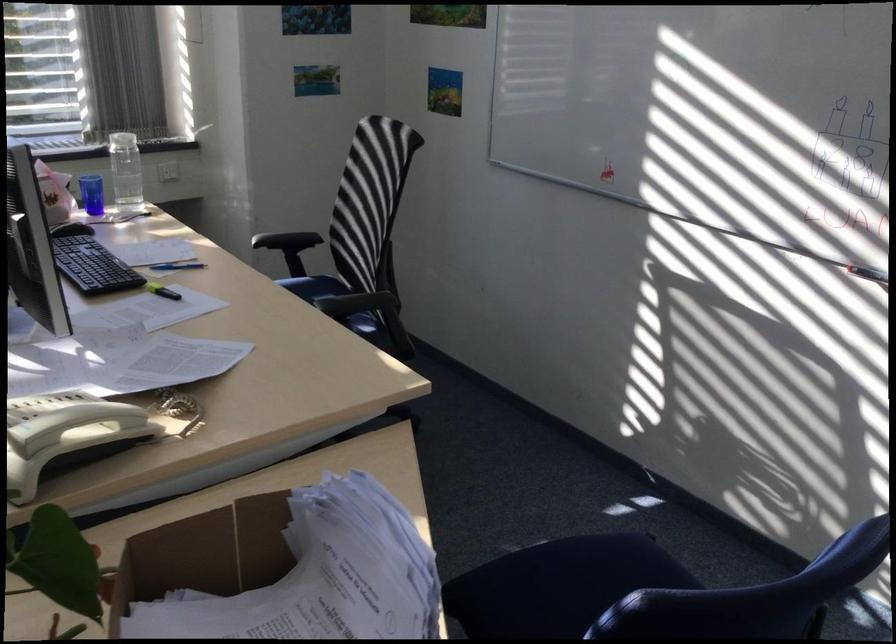
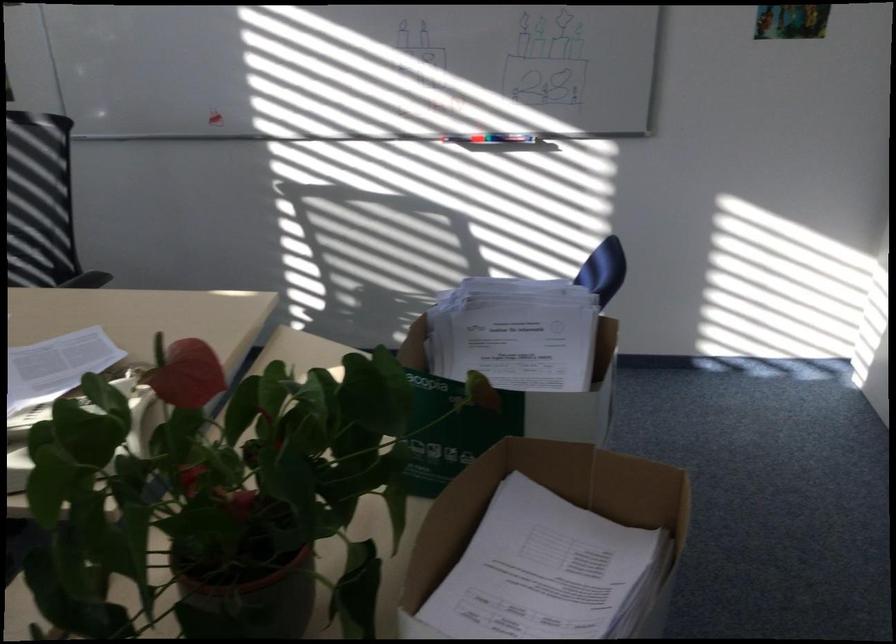
Question: The camera is either moving clockwise (left) or counter-clockwise (right) around the object. The first image is from the beginning of the video and the second image is from the end. Is the camera moving left or right when shooting the video?

Choices:
 (A) Left
 (B) Right

Answer: (A)